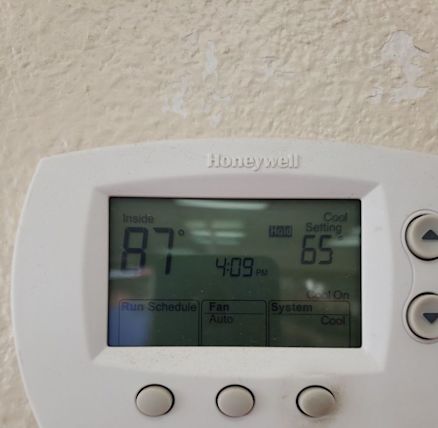
I want to click on wall, so click(63, 132).